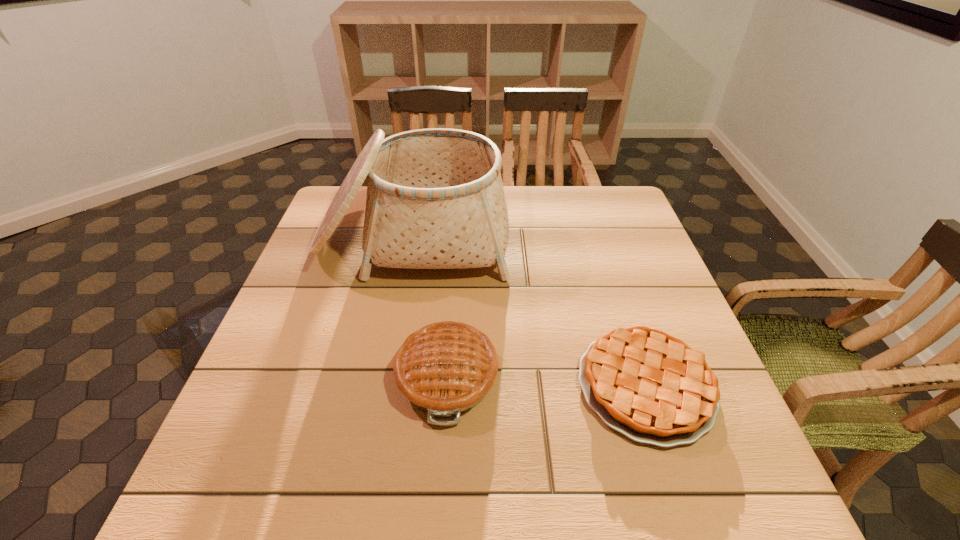
Identify the location of object located at the left edge. Image resolution: width=960 pixels, height=540 pixels. pyautogui.click(x=435, y=199).

Find the location of a particular element. object positioned at the right edge is located at coordinates (652, 387).

Where is `object situated at the far left corner`? object situated at the far left corner is located at coordinates (435, 199).

The height and width of the screenshot is (540, 960). In the image, there is a desktop. Find the location of `free space at the far edge`. free space at the far edge is located at coordinates (546, 190).

The height and width of the screenshot is (540, 960). Find the location of `vacant space at the left edge of the desktop`. vacant space at the left edge of the desktop is located at coordinates (303, 264).

In the image, there is a desktop. Where is `free space at the right edge`? free space at the right edge is located at coordinates (655, 307).

What are the coordinates of `free space at the far right corner` in the screenshot? It's located at (614, 230).

I want to click on free spot between the left pie and the tallest object, so click(x=430, y=307).

You are a GUI agent. You are given a task and a screenshot of the screen. Output one action in this format:
    pyautogui.click(x=<x>, y=<y>)
    Task: Click on the free space between the basket and the right pie
    
    Given the screenshot: What is the action you would take?
    [x=529, y=312]

This screenshot has height=540, width=960. What are the coordinates of `vacant area that lies between the farthest object and the second shortest object` in the screenshot? It's located at (430, 307).